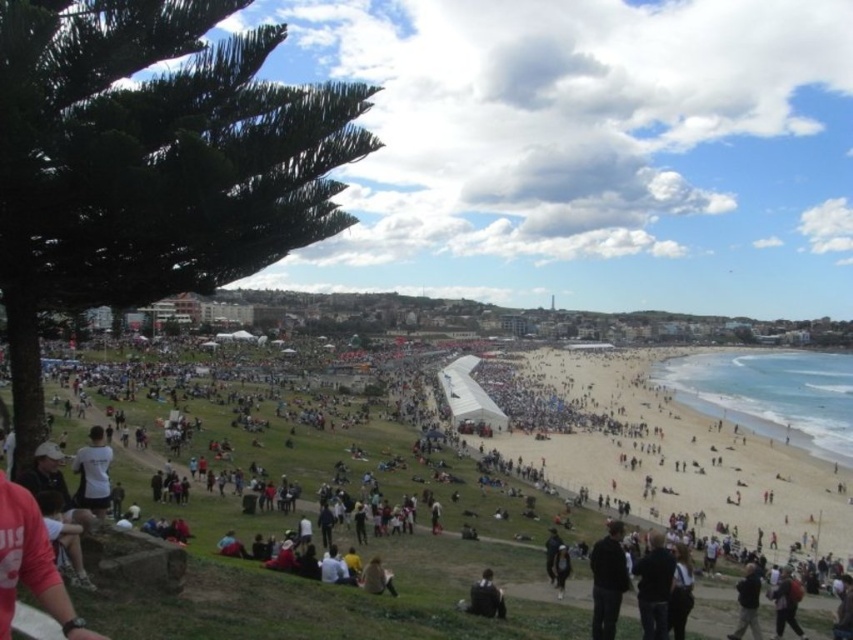
Between dark gray jacket at lower center and dark brown leather jacket at lower center, which one is positioned higher?

dark gray jacket at lower center is above.

How distant is dark gray jacket at lower center from dark brown leather jacket at lower center?

dark gray jacket at lower center is 33.98 feet away from dark brown leather jacket at lower center.

You are a GUI agent. You are given a task and a screenshot of the screen. Output one action in this format:
    pyautogui.click(x=<x>, y=<y>)
    Task: Click on the dark gray jacket at lower center
    
    Given the screenshot: What is the action you would take?
    pyautogui.click(x=607, y=580)

At what (x,y) coordinates should I click in order to perform the action: click on dark gray jacket at lower center. Please return your answer as a coordinate pair (x, y). The height and width of the screenshot is (640, 853). Looking at the image, I should click on (607, 580).

Is white cotton shirt at lower left above dark gray jacket at lower center?

Yes.

Between white cotton shirt at lower left and dark gray jacket at lower center, which one has less height?

dark gray jacket at lower center is shorter.

Describe the element at coordinates (360, 548) in the screenshot. The height and width of the screenshot is (640, 853). I see `white cotton shirt at lower left` at that location.

Locate an element on the screen. This screenshot has width=853, height=640. white cotton shirt at lower left is located at coordinates (360, 548).

Consider the image. Is white cotton shirt at lower left thinner than dark brown leather jacket at lower center?

No.

Is white cotton shirt at lower left positioned before dark brown leather jacket at lower center?

Yes.

Who is more distant from viewer, (833, 499) or (492, 614)?

Point (833, 499)

Find the location of a particular element. This screenshot has width=853, height=640. white cotton shirt at lower left is located at coordinates (360, 548).